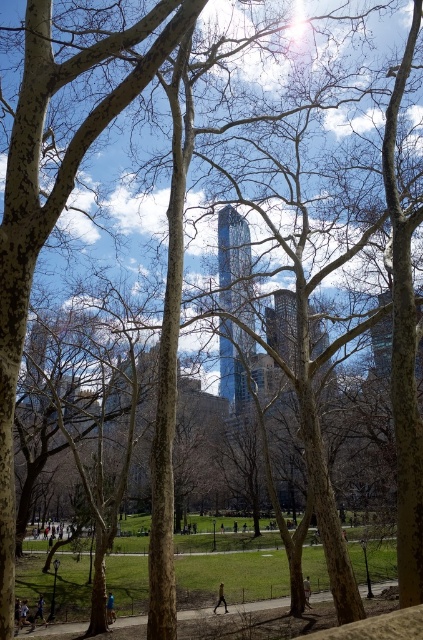
You are standing at the center of the park and want to find the light blue fabric at lower left. Which direction should you look to locate it?

The light blue fabric at lower left is located at the lower left direction from your current position at the center of the park.

You are a delivery person standing at the park entrance and need to deliver a package to someone wearing either the dark gray jacket at center or the light brown leather jacket at lower center. The delivery area has a 8 feet radius. Can you reach both recipients within the delivery radius?

The dark gray jacket at center and light brown leather jacket at lower center are 7.93 feet apart. Since the delivery radius is 8 feet, both recipients are within the delivery area.

You are standing at the center of the park and want to find the blue fabric person at lower left. According to the scene, where should you look relative to the trees in the foreground?

The blue fabric person at lower left is located at point (22,616), which is near the lower left corner of the scene. Since the trees are in the foreground occupying the lower portion, the person is positioned just outside or at the edge of the trees on the left side, so you should look towards the lower left area beyond the tree branches.